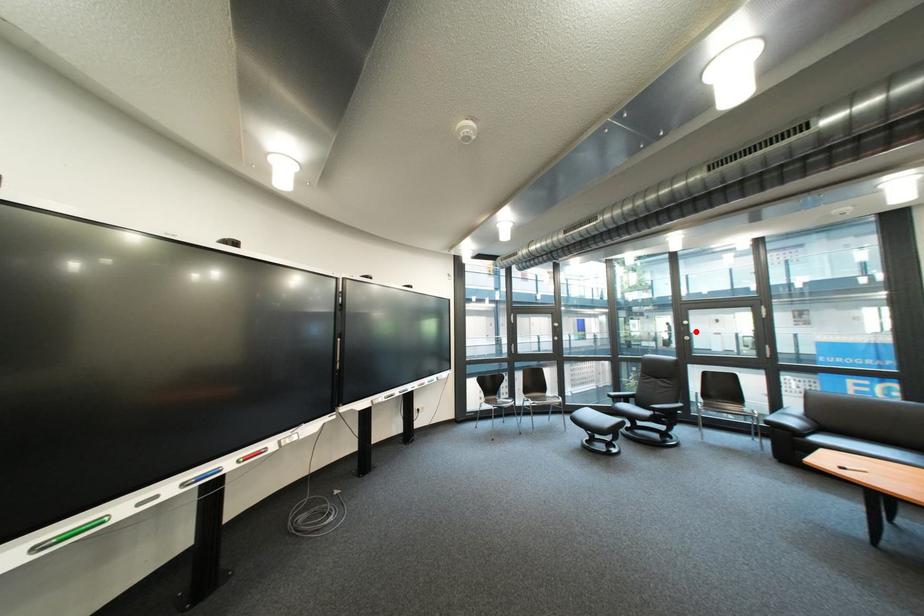
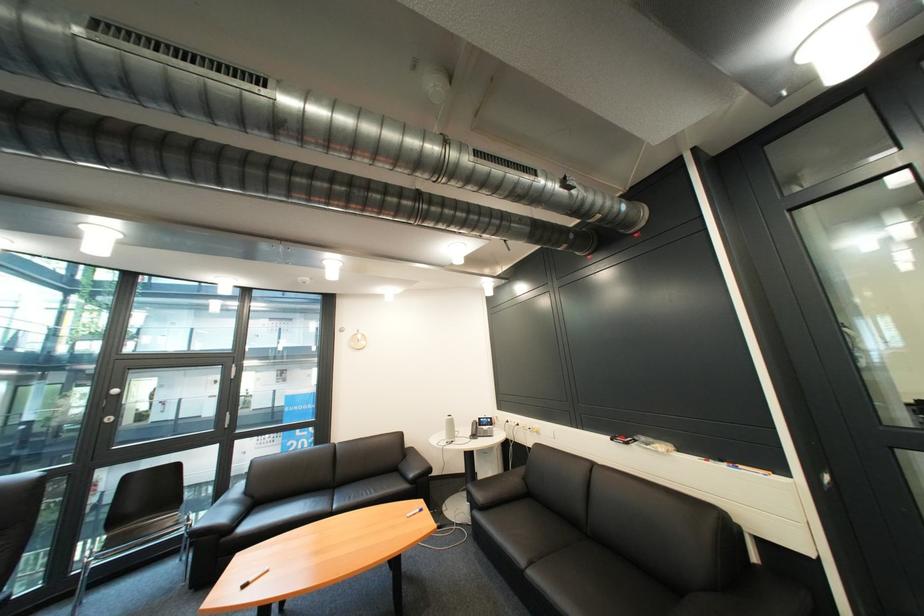
Question: A red point is marked in image1. In image2, is the corresponding 3D point closer to the camera or farther? Reply with the corresponding letter.

Choices:
 (A) The corresponding 3D point is closer.
 (B) The corresponding 3D point is farther.

Answer: (A)